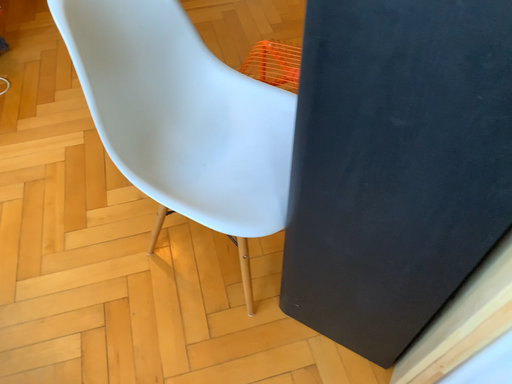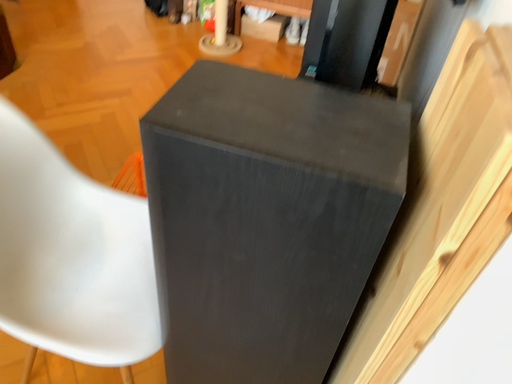
Question: Which way did the camera rotate in the video?

Choices:
 (A) rotated right
 (B) rotated left

Answer: (A)